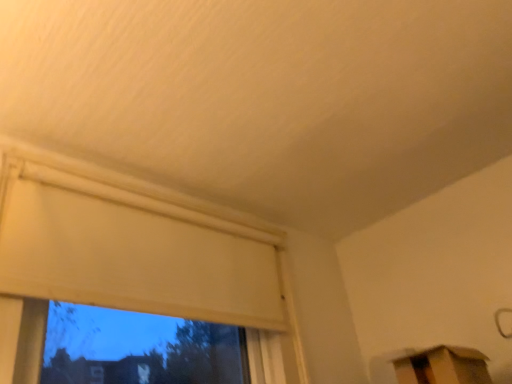
Question: Is point (178, 274) closer or farther from the camera than point (421, 369)?

Choices:
 (A) closer
 (B) farther

Answer: (B)

Question: In the image, is matte white window at upper left positioned in front of or behind cardboard box at lower right?

Choices:
 (A) behind
 (B) front

Answer: (B)

Question: From a real-world perspective, relative to cardboard box at lower right, is matte white window at upper left vertically above or below?

Choices:
 (A) above
 (B) below

Answer: (A)

Question: Considering the positions of cardboard box at lower right and matte white window at upper left in the image, is cardboard box at lower right taller or shorter than matte white window at upper left?

Choices:
 (A) tall
 (B) short

Answer: (B)

Question: Is cardboard box at lower right spatially inside matte white window at upper left, or outside of it?

Choices:
 (A) outside
 (B) inside

Answer: (A)

Question: Is point (465, 382) positioned closer to the camera than point (126, 279)?

Choices:
 (A) closer
 (B) farther

Answer: (A)

Question: From the image's perspective, is cardboard box at lower right above or below matte white window at upper left?

Choices:
 (A) below
 (B) above

Answer: (A)